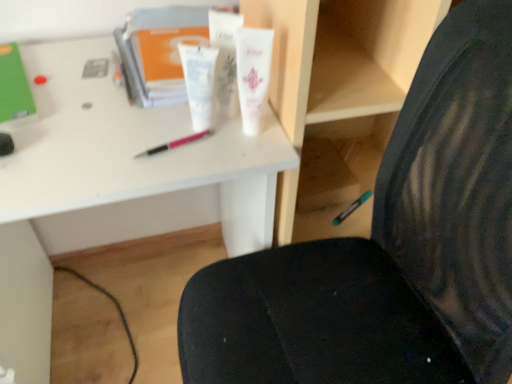
Image resolution: width=512 pixels, height=384 pixels. Find the location of `free space in front of white matte tube at center, the third toiletry viewed from the left`. free space in front of white matte tube at center, the third toiletry viewed from the left is located at coordinates (238, 158).